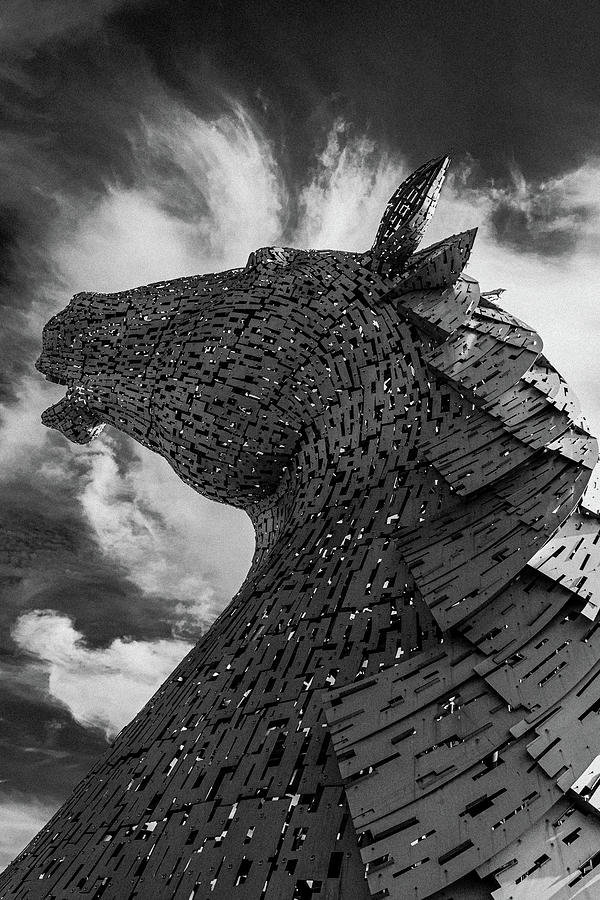
At what (x,y) coordinates should I click in order to perform the action: click on wooden statue of horse. Please return your answer as a coordinate pair (x, y). The height and width of the screenshot is (900, 600). Looking at the image, I should click on (277, 869).